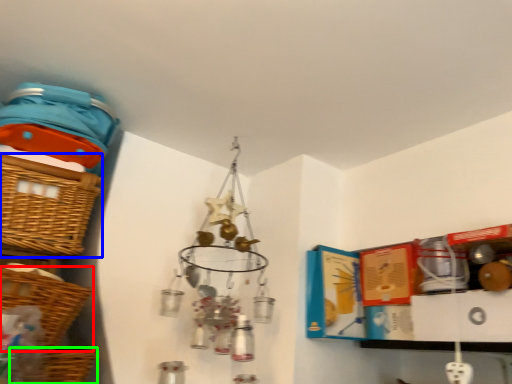
Question: Which object is positioned farthest from basket (highlighted by a red box)? Select from basket (highlighted by a blue box) and basket (highlighted by a green box).

Choices:
 (A) basket
 (B) basket

Answer: (A)